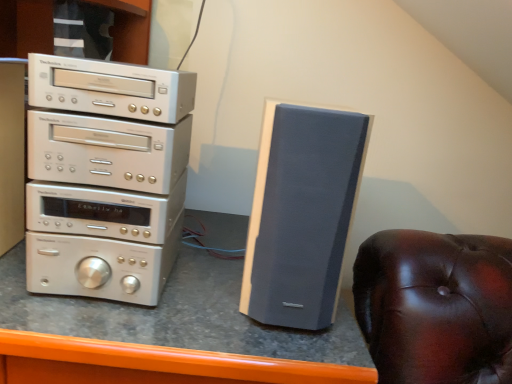
At what (x,y) coordinates should I click in order to perform the action: click on free point in front of matte gray speaker at right. Please return your answer as a coordinate pair (x, y). Looking at the image, I should click on (269, 345).